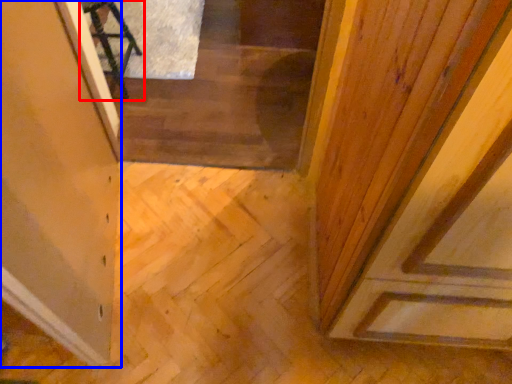
Question: Which point is closer to the camera, furniture (highlighted by a red box) or glass door (highlighted by a blue box)?

Choices:
 (A) furniture
 (B) glass door

Answer: (B)